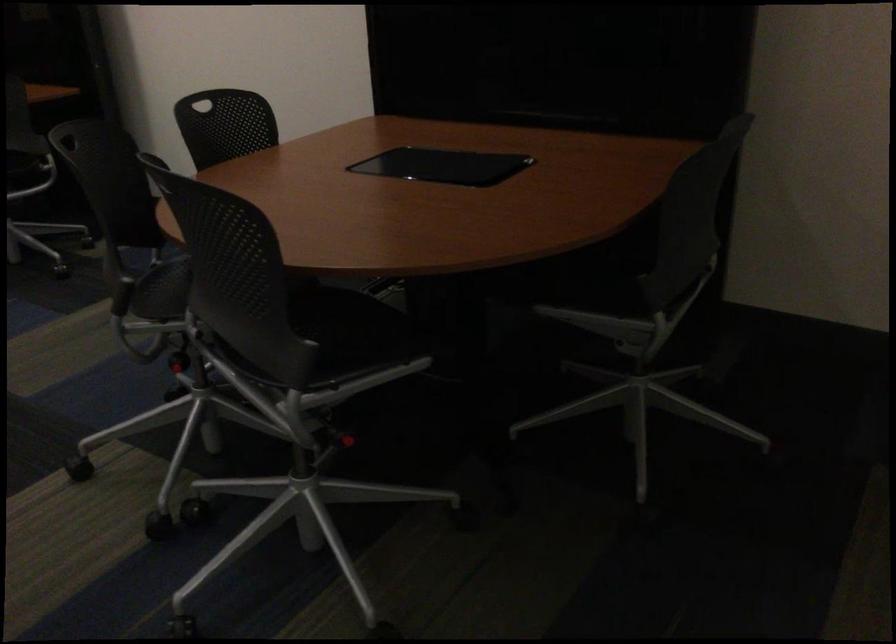
Identify the location of red chair lever. The width and height of the screenshot is (896, 644). (352, 438).